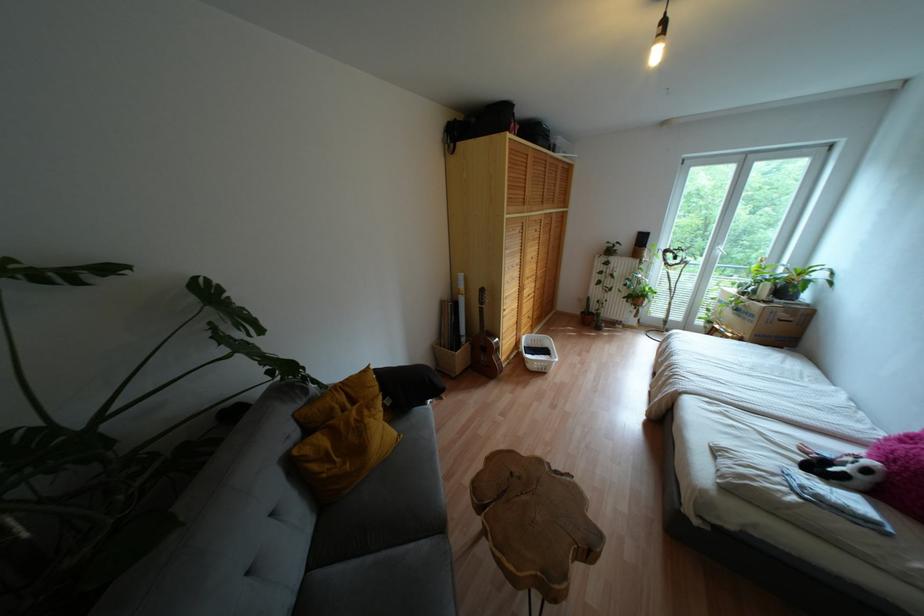
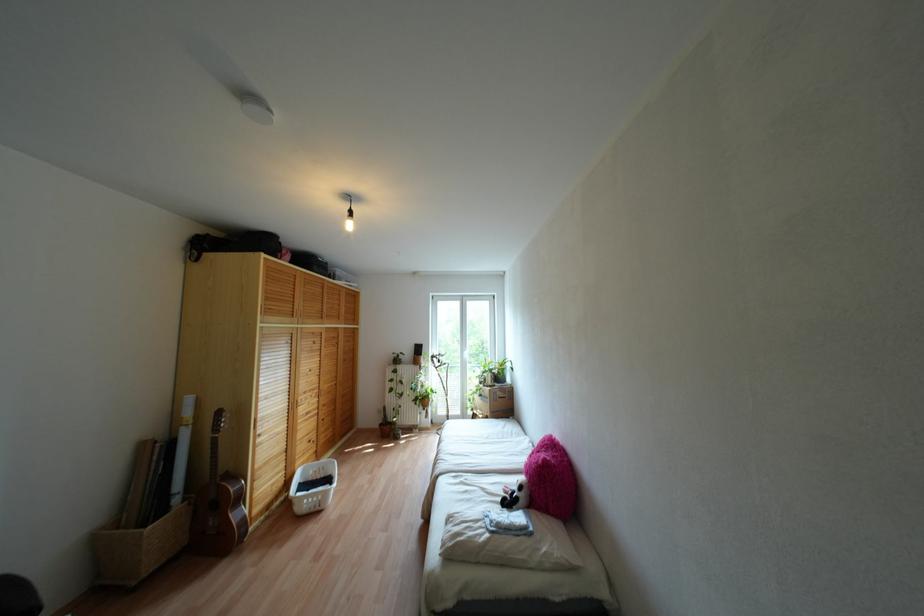
Locate, in the second image, the point that corresponds to (x=715, y=325) in the first image.

(473, 411)